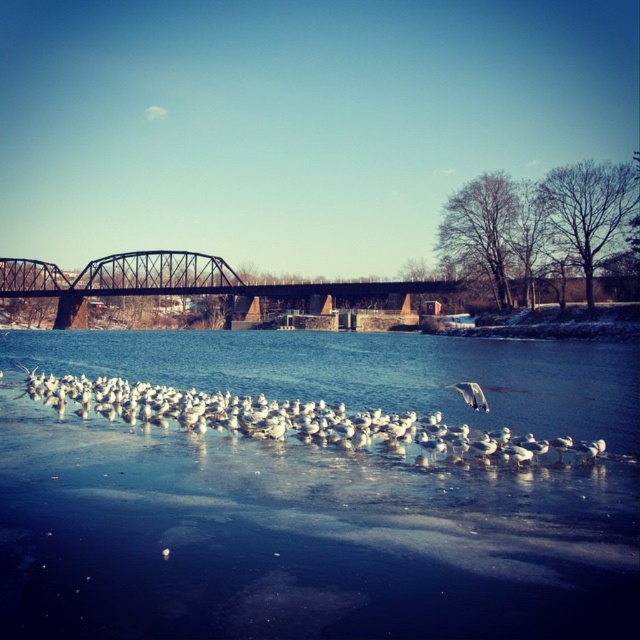
You are standing on the black metal bridge and see the white feathered birds at center and the white feathered bird at center. Which group is closer to you?

The white feathered birds at center are closer to you than the white feathered bird at center.